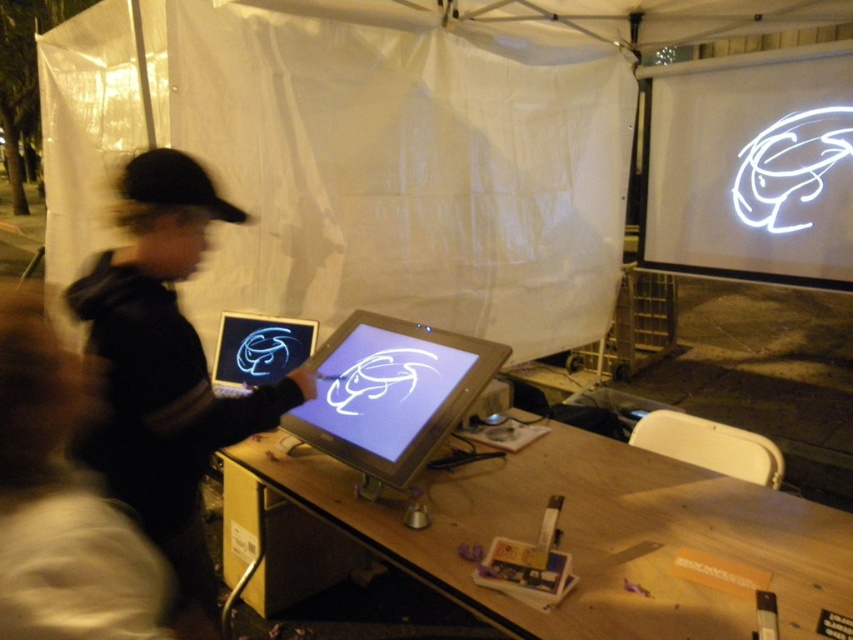
What do you see at coordinates (165, 368) in the screenshot? I see `black matte laptop at left` at bounding box center [165, 368].

Does black matte laptop at left appear under black matte baseball hat at left?

Correct, black matte laptop at left is located below black matte baseball hat at left.

Who is more distant from viewer, (74, 285) or (206, 192)?

The point (74, 285) is more distant.

The height and width of the screenshot is (640, 853). In order to click on black matte laptop at left in this screenshot , I will do `click(165, 368)`.

Is point (756, 108) positioned before point (374, 420)?

No, (756, 108) is further to viewer.

Can you confirm if white glossy projection screen at upper right is thinner than matte plastic screen at center?

In fact, white glossy projection screen at upper right might be wider than matte plastic screen at center.

Is point (766, 112) closer to viewer compared to point (338, 342)?

That is False.

Find the location of a particular element. white glossy projection screen at upper right is located at coordinates (752, 166).

Is point (161, 458) positioned after point (776, 266)?

That is False.

Which is more to the left, black matte laptop at left or white glossy projection screen at upper right?

From the viewer's perspective, black matte laptop at left appears more on the left side.

Between point (115, 348) and point (755, 205), which one is positioned in front?

Positioned in front is point (115, 348).

At what (x,y) coordinates should I click in order to perform the action: click on black matte laptop at left. Please return your answer as a coordinate pair (x, y). This screenshot has height=640, width=853. Looking at the image, I should click on (165, 368).